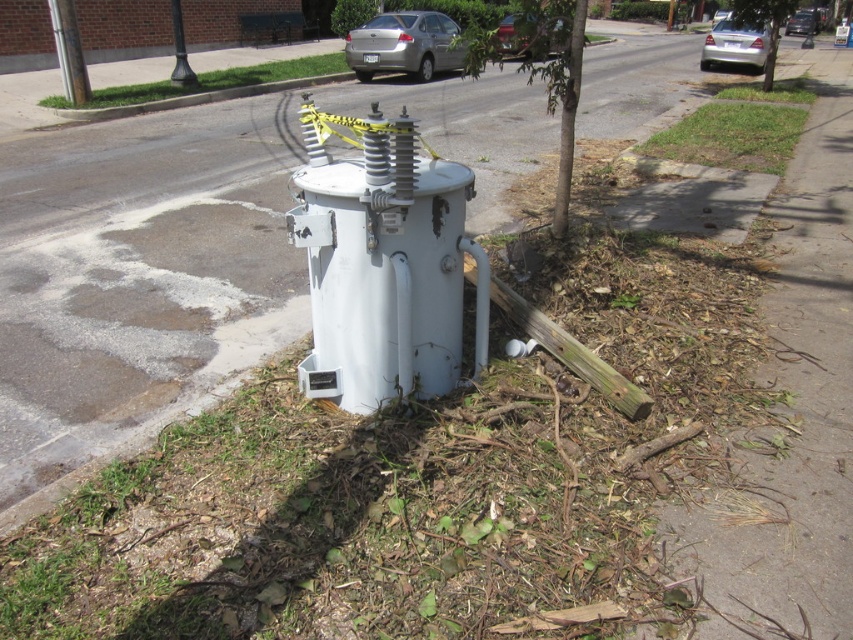
This screenshot has width=853, height=640. Describe the element at coordinates (514, 36) in the screenshot. I see `metallic silver sedan at upper center` at that location.

Is metallic silver sedan at upper center bigger than black glossy pole at upper center?

Correct, metallic silver sedan at upper center is larger in size than black glossy pole at upper center.

Does point (515, 38) lie in front of point (175, 42)?

That is False.

Identify the location of metallic silver sedan at upper center. (514, 36).

Between silver metallic sedan at upper center and metallic silver sedan at upper center, which one appears on the right side from the viewer's perspective?

metallic silver sedan at upper center

Measure the distance between silver metallic sedan at upper center and metallic silver sedan at upper center.

The distance of silver metallic sedan at upper center from metallic silver sedan at upper center is 3.76 meters.

Does point (405, 24) come closer to viewer compared to point (509, 38)?

Yes, it is.

Image resolution: width=853 pixels, height=640 pixels. Find the location of `silver metallic sedan at upper center`. silver metallic sedan at upper center is located at coordinates (405, 45).

Is silver metallic car at upper right thinner than silver metallic car at upper center?

Correct, silver metallic car at upper right's width is less than silver metallic car at upper center's.

Is point (712, 60) positioned behind point (793, 13)?

No.

This screenshot has height=640, width=853. What are the coordinates of `silver metallic car at upper right` in the screenshot? It's located at (735, 44).